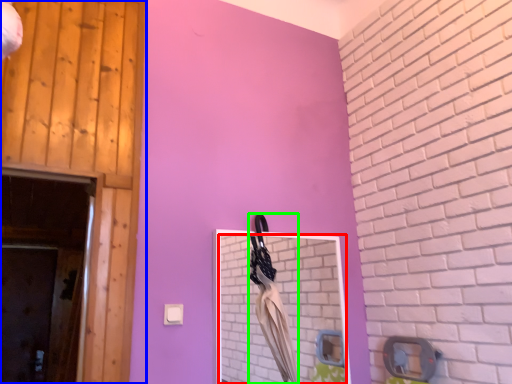
Question: Based on their relative distances, which object is nearer to mirror (highlighted by a red box)? Choose from door (highlighted by a blue box) and laundry (highlighted by a green box).

Choices:
 (A) door
 (B) laundry

Answer: (B)